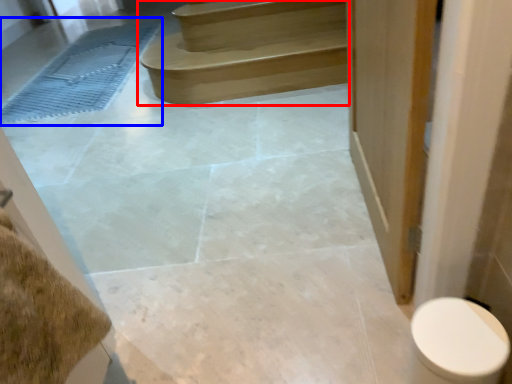
Question: Which point is closer to the camera, stairs (highlighted by a red box) or bath mat (highlighted by a blue box)?

Choices:
 (A) stairs
 (B) bath mat

Answer: (A)